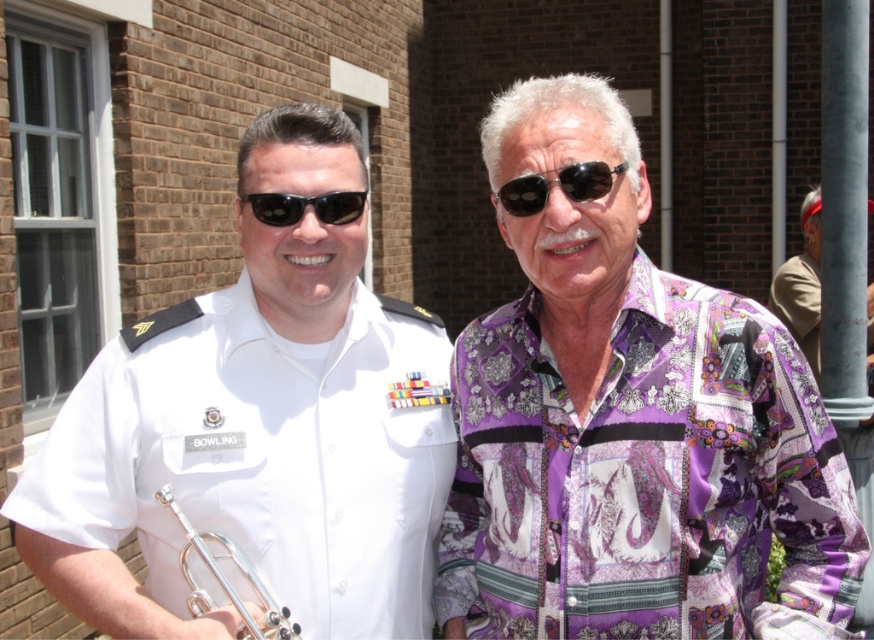
Question: Is the position of purple patterned shirt at right more distant than that of silver metallic trumpet at lower left?

Choices:
 (A) yes
 (B) no

Answer: (A)

Question: Is white uniform at center smaller than black plastic sunglasses at center?

Choices:
 (A) no
 (B) yes

Answer: (A)

Question: Can you confirm if black reflective sunglasses at center is positioned above black plastic sunglasses at center?

Choices:
 (A) yes
 (B) no

Answer: (A)

Question: Which object appears closest to the camera in this image?

Choices:
 (A) purple satin shirt at center
 (B) white uniform at center

Answer: (B)

Question: Which point appears farthest from the camera in this image?

Choices:
 (A) (271, 120)
 (B) (622, 163)
 (C) (293, 636)
 (D) (539, 461)

Answer: (A)

Question: Among these objects, which one is nearest to the camera?

Choices:
 (A) black plastic sunglasses at center
 (B) purple patterned shirt at right
 (C) purple satin shirt at center
 (D) black reflective sunglasses at center

Answer: (C)